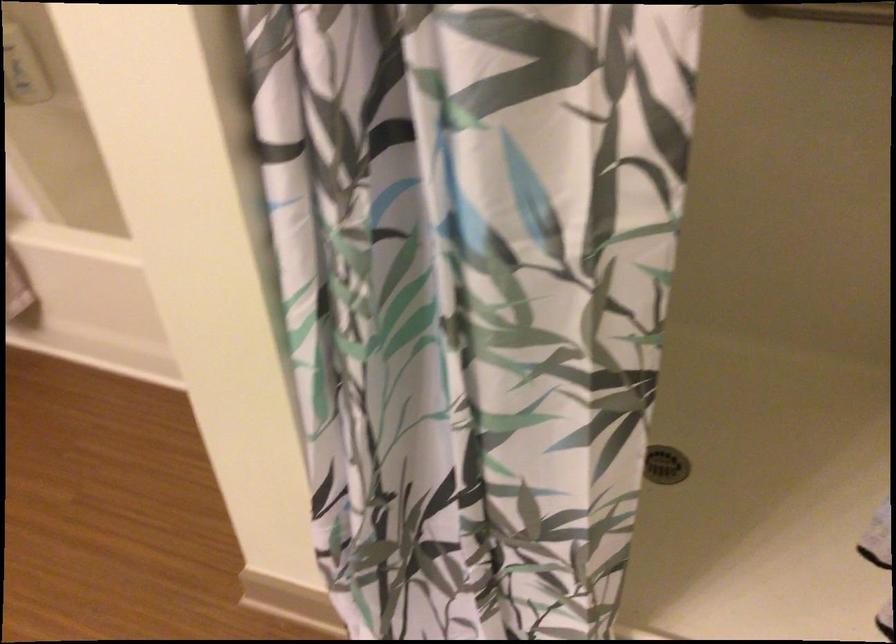
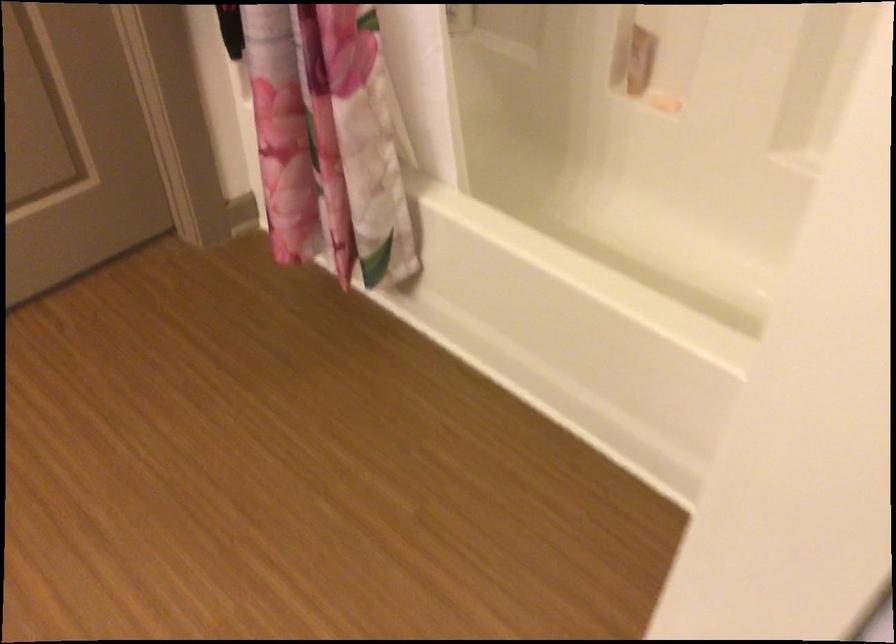
Question: The camera is either moving clockwise (left) or counter-clockwise (right) around the object. The first image is from the beginning of the video and the second image is from the end. Is the camera moving left or right when shooting the video?

Choices:
 (A) Left
 (B) Right

Answer: (B)